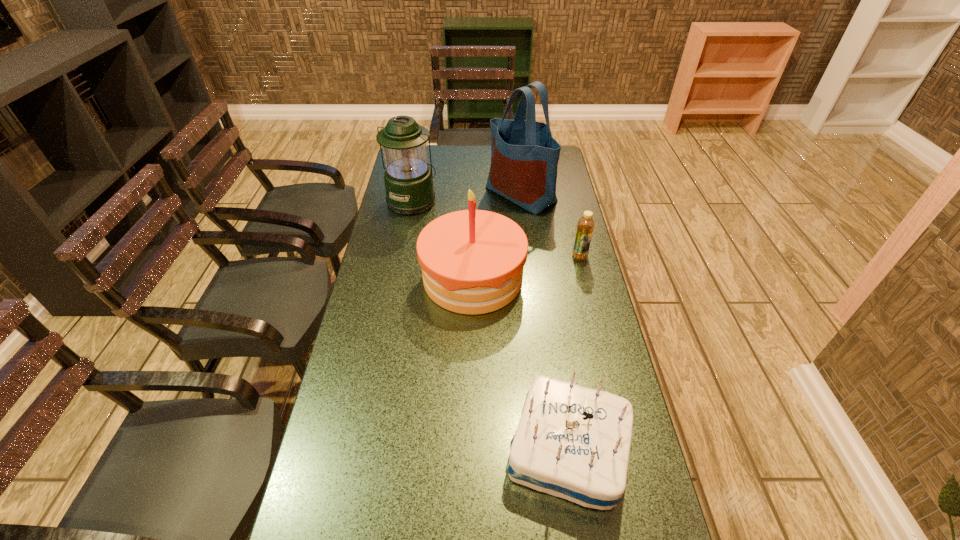
Find the location of a particular element. The image size is (960, 540). handbag is located at coordinates (524, 156).

Locate an element on the screen. the farther birthday cake is located at coordinates (472, 261).

At what (x,y) coordinates should I click in order to perform the action: click on lantern. Please return your answer as a coordinate pair (x, y). This screenshot has height=540, width=960. Looking at the image, I should click on (408, 179).

In order to click on the nearer birthday cake in this screenshot , I will do `click(572, 442)`.

The image size is (960, 540). I want to click on the nearest object, so click(x=572, y=442).

Where is `bottle`? The image size is (960, 540). bottle is located at coordinates (585, 226).

At what (x,y) coordinates should I click in order to perform the action: click on blank area located on the front of the handbag. Please return your answer as a coordinate pair (x, y). The image size is (960, 540). Looking at the image, I should click on (532, 285).

The width and height of the screenshot is (960, 540). In order to click on vacant space located on the front of the taller birthday cake in this screenshot , I will do `click(470, 435)`.

Where is `vacant space located on the back of the lantern`? The height and width of the screenshot is (540, 960). vacant space located on the back of the lantern is located at coordinates (417, 179).

Image resolution: width=960 pixels, height=540 pixels. Find the location of `free space located 0.360m on the left of the nearer birthday cake`. free space located 0.360m on the left of the nearer birthday cake is located at coordinates (354, 450).